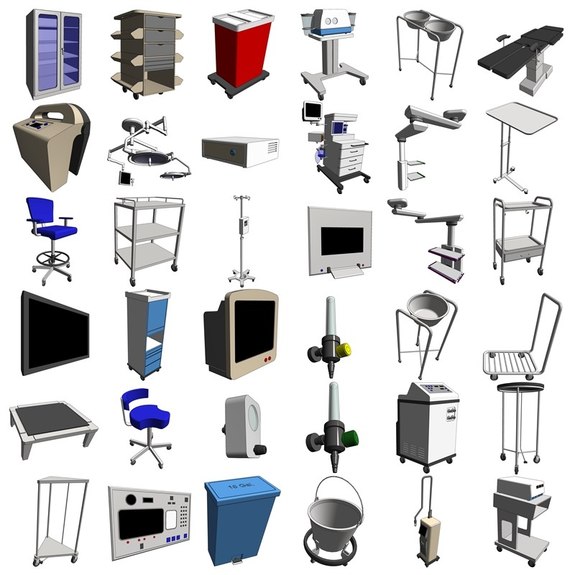
This screenshot has width=575, height=575. I want to click on bowl or bucket, so click(341, 520), click(428, 310), click(439, 29), click(415, 15).